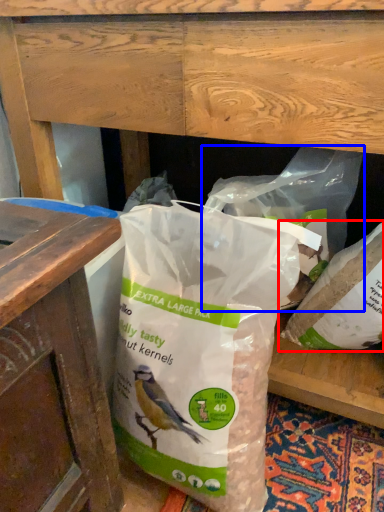
Question: Which object is further to the camera taking this photo, plastic bag (highlighted by a red box) or plastic bag (highlighted by a blue box)?

Choices:
 (A) plastic bag
 (B) plastic bag

Answer: (A)